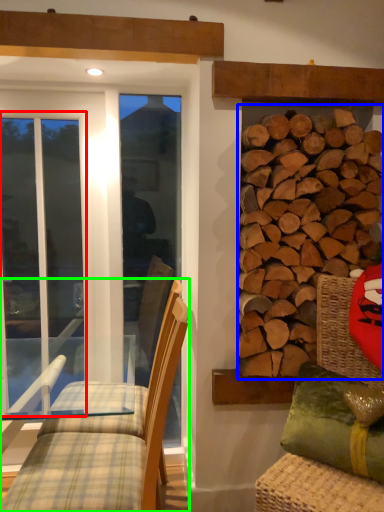
Question: Considering the real-world distances, which object is closest to screen door (highlighted by a red box)? hardwood (highlighted by a blue box) or chair (highlighted by a green box).

Choices:
 (A) hardwood
 (B) chair

Answer: (B)